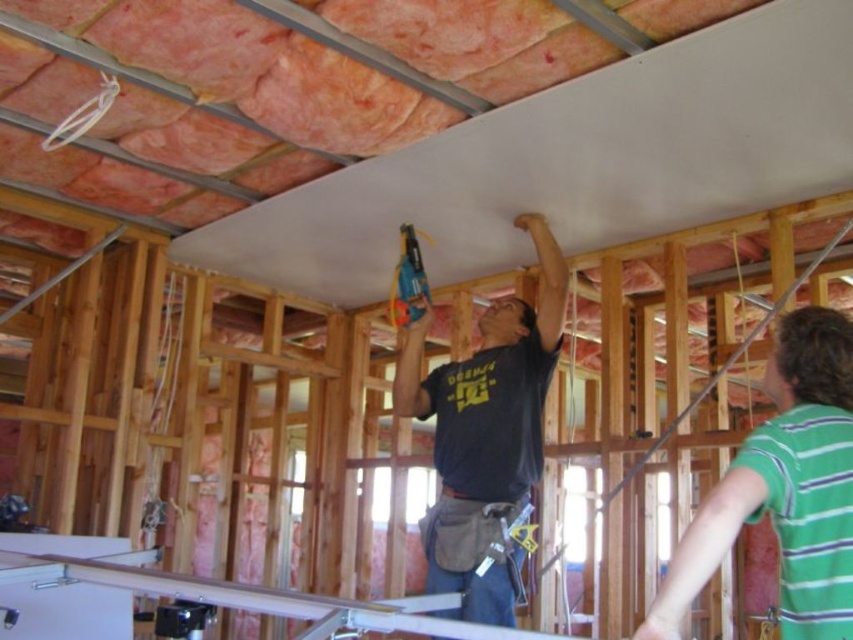
You are a safety inspector at the construction site. You need to ensure that the green striped shirt at upper right and the dark gray shirt at upper center are visible to each other for communication. Given their widths, which shirt might be more likely to block the other from view?

The green striped shirt at upper right has a lesser width compared to the dark gray shirt at upper center. Therefore, the wider dark gray shirt at upper center might block the view of the narrower green striped shirt at upper right.

You are standing in the construction site and see two points marked in the image. Which point is closer to you, point (554,248) or point (404,300)?

Point (554,248) is further to the viewer than point (404,300), so point (404,300) is closer to you.

You are a contractor assessing the safety of the construction site. You notice the dark gray shirt at upper center and the blue plastic drill at center. Which object is closer to you from your vantage point?

The dark gray shirt at upper center is closer to you because it is in front of the blue plastic drill at center.